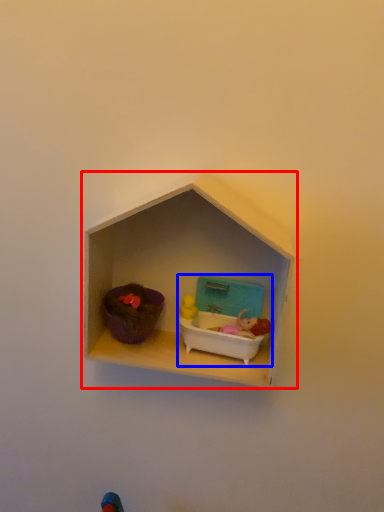
Question: Which object appears closest to the camera in this image, shelf (highlighted by a red box) or toy (highlighted by a blue box)?

Choices:
 (A) shelf
 (B) toy

Answer: (A)